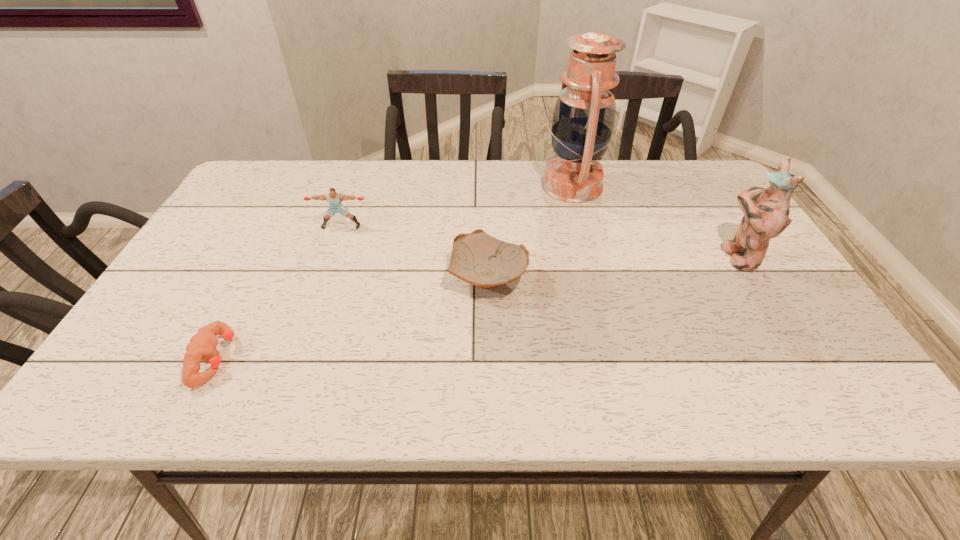
Locate an element on the screen. This screenshot has width=960, height=540. free space between the rightmost object and the fourth object from left to right is located at coordinates (655, 220).

Find the location of a particular element. free space between the third object from right to left and the fourth object from left to right is located at coordinates (530, 231).

Where is `free space between the shorter puncher and the pottery`? free space between the shorter puncher and the pottery is located at coordinates (352, 317).

What are the coordinates of `vacant space that is in between the pottery and the figurine` in the screenshot? It's located at coord(612,266).

Find the location of a particular element. vacant space that's between the third tallest object and the rightmost object is located at coordinates pyautogui.click(x=540, y=240).

Where is `free point between the taller puncher and the second shortest object`? free point between the taller puncher and the second shortest object is located at coordinates (415, 251).

I want to click on free space between the tallest object and the fourth shortest object, so click(655, 220).

The width and height of the screenshot is (960, 540). Find the location of `vacant area between the taller puncher and the figurine`. vacant area between the taller puncher and the figurine is located at coordinates (540, 240).

At what (x,y) coordinates should I click in order to perform the action: click on vacant area between the farthest object and the fourth shortest object. Please return your answer as a coordinate pair (x, y). The width and height of the screenshot is (960, 540). Looking at the image, I should click on (655, 220).

Image resolution: width=960 pixels, height=540 pixels. In order to click on free space between the pottery and the nearest object in this screenshot , I will do `click(352, 317)`.